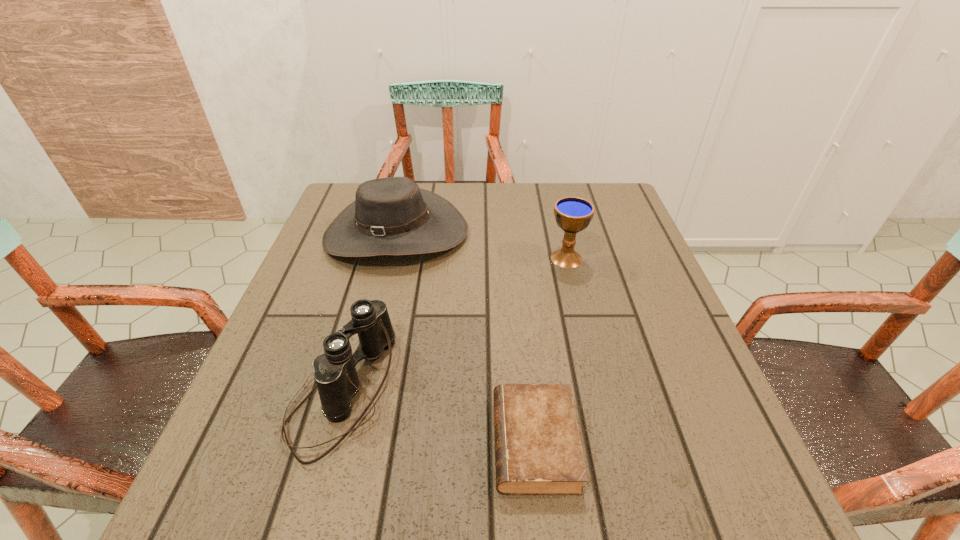
The width and height of the screenshot is (960, 540). I want to click on the rightmost object, so click(x=573, y=214).

This screenshot has width=960, height=540. Identify the location of cowboy hat. (392, 216).

Image resolution: width=960 pixels, height=540 pixels. Find the location of `binoculars`. binoculars is located at coordinates (334, 371).

This screenshot has width=960, height=540. Find the location of `the shortest object`. the shortest object is located at coordinates (538, 451).

The width and height of the screenshot is (960, 540). Identify the location of diary. (538, 451).

This screenshot has width=960, height=540. Find the location of `blank space located 0.080m on the back of the rightmost object`. blank space located 0.080m on the back of the rightmost object is located at coordinates (560, 228).

Where is `vacant point located 0.170m on the front-facing side of the cowboy hat`? Image resolution: width=960 pixels, height=540 pixels. vacant point located 0.170m on the front-facing side of the cowboy hat is located at coordinates (373, 326).

Where is `free space located on the back of the binoculars`? free space located on the back of the binoculars is located at coordinates (367, 305).

Image resolution: width=960 pixels, height=540 pixels. What are the coordinates of `free space located 0.360m on the spine side of the shortest object` in the screenshot? It's located at (269, 443).

Where is `vacant space located on the spine side of the shortest object`? vacant space located on the spine side of the shortest object is located at coordinates (331, 443).